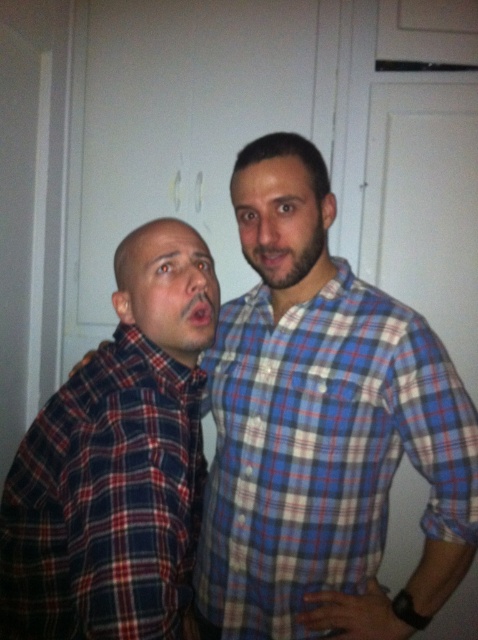
Question: Estimate the real-world distances between objects in this image. Which object is farther from the blue plaid shirt at center?

Choices:
 (A) red plaid shirt at left
 (B) matte blue plaid shirt at center
 (C) matte plaid shirt at left

Answer: (C)

Question: Which point is closer to the camera?

Choices:
 (A) (271, 196)
 (B) (438, 378)
 (C) (152, 355)

Answer: (C)

Question: From the image, what is the correct spatial relationship of matte plaid shirt at left in relation to matte blue plaid shirt at center?

Choices:
 (A) left
 (B) right

Answer: (A)

Question: Is blue plaid shirt at center closer to camera compared to red plaid shirt at left?

Choices:
 (A) no
 (B) yes

Answer: (A)

Question: Which point is closer to the camera taking this photo?

Choices:
 (A) (56, 435)
 (B) (377, 547)

Answer: (A)

Question: Is blue plaid shirt at center wider than matte plaid shirt at left?

Choices:
 (A) yes
 (B) no

Answer: (A)